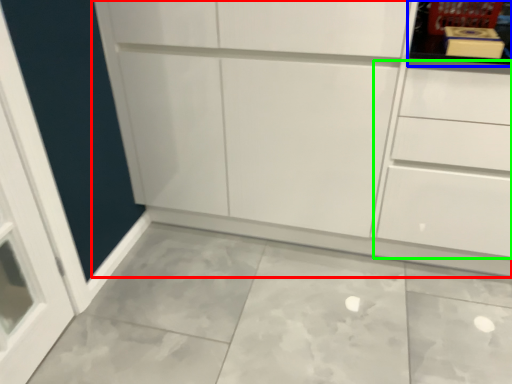
Question: Based on their relative distances, which object is farther from cupboard (highlighted by a red box)? Choose from shelf (highlighted by a blue box) and drawer (highlighted by a green box).

Choices:
 (A) shelf
 (B) drawer

Answer: (A)